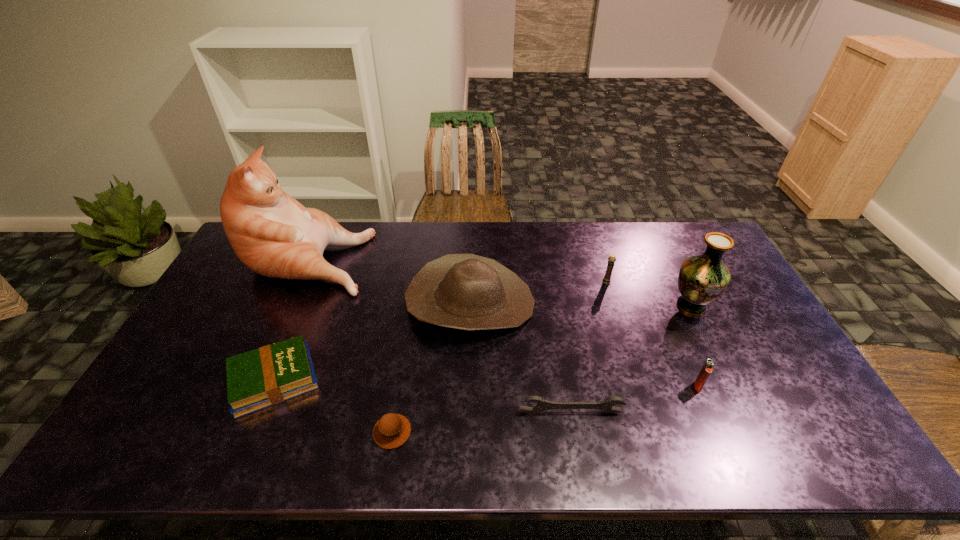
What are the coordinates of `object at the near edge` in the screenshot? It's located at (392, 430).

Where is `object present at the left edge`? The height and width of the screenshot is (540, 960). object present at the left edge is located at coordinates (274, 235).

Locate an element on the screen. This screenshot has height=540, width=960. object situated at the right edge is located at coordinates (702, 279).

Where is `object that is positioned at the far left corner`? object that is positioned at the far left corner is located at coordinates (274, 235).

Image resolution: width=960 pixels, height=540 pixels. In order to click on vacant space at the far edge of the desktop in this screenshot , I will do `click(615, 241)`.

You are a GUI agent. You are given a task and a screenshot of the screen. Output one action in this format:
    pyautogui.click(x=<x>, y=<y>)
    Task: Click on the vacant region at the near edge of the desktop
    The height and width of the screenshot is (540, 960).
    Given the screenshot: What is the action you would take?
    pyautogui.click(x=202, y=431)

Find the location of a particular element. The width and height of the screenshot is (960, 540). vacant space at the left edge is located at coordinates (237, 277).

In the image, there is a desktop. Where is `vacant space at the right edge`? vacant space at the right edge is located at coordinates (737, 374).

Identify the location of free location at the near left corner of the desktop. (178, 449).

In the image, there is a desktop. In order to click on vacant space at the far right corner in this screenshot , I will do `click(686, 228)`.